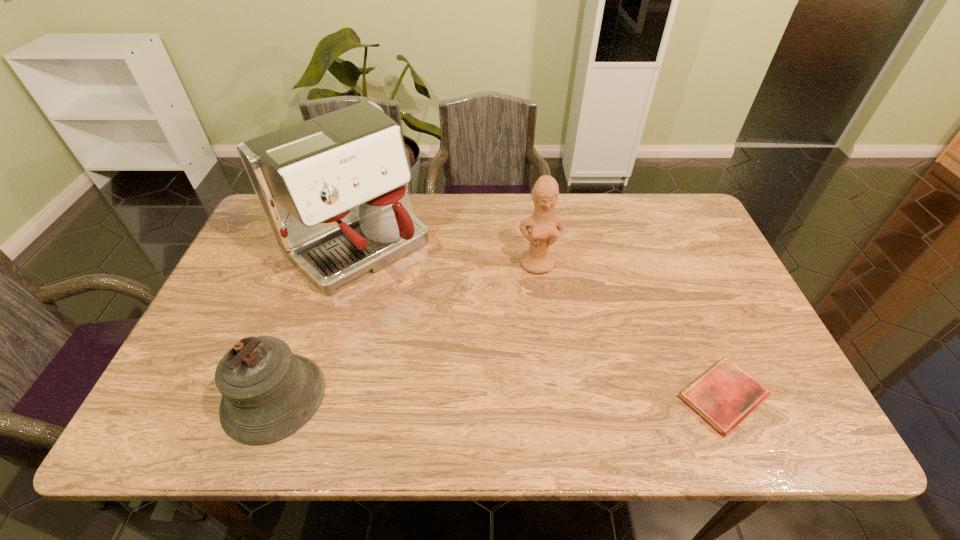
What are the coordinates of `free space located 0.400m on the front of the tallest object near the spout` in the screenshot? It's located at (493, 377).

The height and width of the screenshot is (540, 960). I want to click on free location located on the front-facing side of the second object from right to left, so click(x=552, y=336).

At what (x,y) coordinates should I click in order to perform the action: click on vacant region located on the front-facing side of the second object from right to left. Please return your answer as a coordinate pair (x, y). This screenshot has height=540, width=960. Looking at the image, I should click on (549, 320).

Find the location of a particular element. This screenshot has width=960, height=540. vacant space located on the front-facing side of the second object from right to left is located at coordinates (557, 363).

At what (x,y) coordinates should I click in order to perform the action: click on object located in the far edge section of the desktop. Please return your answer as a coordinate pair (x, y). This screenshot has width=960, height=540. Looking at the image, I should click on (332, 189).

The image size is (960, 540). What are the coordinates of `bell located in the near edge section of the desktop` in the screenshot? It's located at (268, 393).

The width and height of the screenshot is (960, 540). In order to click on diary located in the near edge section of the desktop in this screenshot , I will do `click(723, 396)`.

Where is `bell positioned at the left edge`? bell positioned at the left edge is located at coordinates (268, 393).

Where is `coffee maker that is at the left edge`? This screenshot has width=960, height=540. coffee maker that is at the left edge is located at coordinates (332, 189).

You are a GUI agent. You are given a task and a screenshot of the screen. Output one action in this format:
    pyautogui.click(x=<x>, y=<y>)
    Task: Click on the object positioned at the right edge
    The height and width of the screenshot is (540, 960).
    Given the screenshot: What is the action you would take?
    pyautogui.click(x=723, y=396)